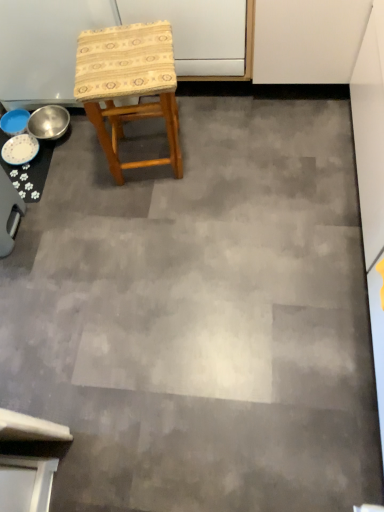
Question: From a real-world perspective, is metallic silver bowl at left over white glossy plate at lower left?

Choices:
 (A) no
 (B) yes

Answer: (B)

Question: Does metallic silver bowl at left have a lesser height compared to white glossy plate at lower left?

Choices:
 (A) no
 (B) yes

Answer: (A)

Question: Does metallic silver bowl at left turn towards white glossy plate at lower left?

Choices:
 (A) no
 (B) yes

Answer: (A)

Question: Is metallic silver bowl at left taller than white glossy plate at lower left?

Choices:
 (A) yes
 (B) no

Answer: (A)

Question: Considering the relative positions of metallic silver bowl at left and white glossy plate at lower left in the image provided, is metallic silver bowl at left to the right of white glossy plate at lower left from the viewer's perspective?

Choices:
 (A) no
 (B) yes

Answer: (B)

Question: Is woven fabric stool at center situated inside blue glossy bowls at left or outside?

Choices:
 (A) outside
 (B) inside

Answer: (A)

Question: Considering the relative positions of woven fabric stool at center and blue glossy bowls at left in the image provided, is woven fabric stool at center to the left or to the right of blue glossy bowls at left?

Choices:
 (A) right
 (B) left

Answer: (A)

Question: From a real-world perspective, is woven fabric stool at center above or below blue glossy bowls at left?

Choices:
 (A) above
 (B) below

Answer: (A)

Question: In terms of height, does woven fabric stool at center look taller or shorter compared to blue glossy bowls at left?

Choices:
 (A) short
 (B) tall

Answer: (B)

Question: In the image, is white glossy plate at lower left on the left side or the right side of woven fabric stool at center?

Choices:
 (A) left
 (B) right

Answer: (A)

Question: Is point (21, 153) positioned closer to the camera than point (77, 92)?

Choices:
 (A) farther
 (B) closer

Answer: (A)

Question: Is white glossy plate at lower left bigger or smaller than woven fabric stool at center?

Choices:
 (A) small
 (B) big

Answer: (A)

Question: From the image's perspective, is white glossy plate at lower left above or below woven fabric stool at center?

Choices:
 (A) above
 (B) below

Answer: (B)

Question: Does point (117, 29) appear closer or farther from the camera than point (61, 132)?

Choices:
 (A) farther
 (B) closer

Answer: (B)

Question: Do you think woven fabric stool at center is within metallic silver bowl at left, or outside of it?

Choices:
 (A) outside
 (B) inside

Answer: (A)